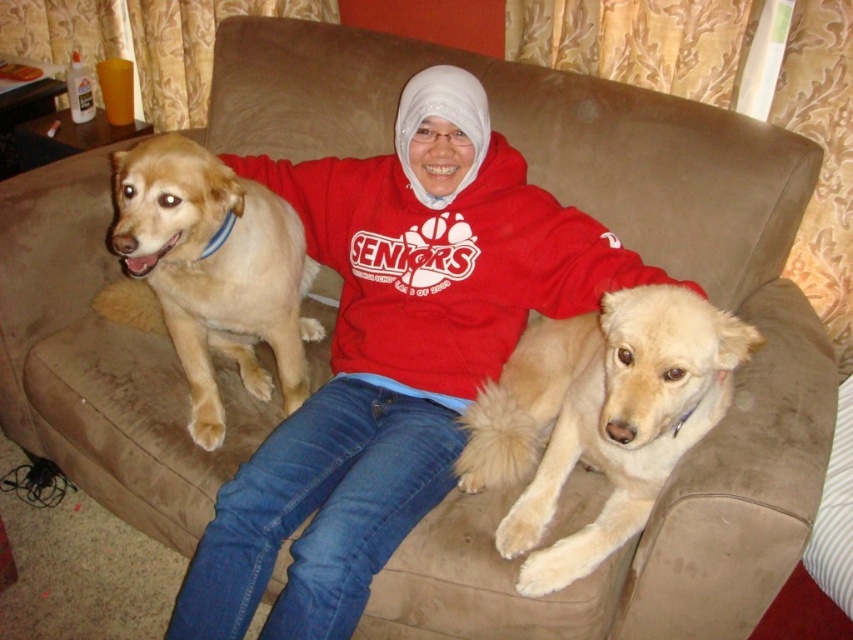
In the scene shown: You are a photographer trying to capture a photo of the fuzzy beige dog at center and the golden fur dog at left. If you want to ensure both dogs are in focus, which dog should you focus on first, the taller one or the shorter one?

The fuzzy beige dog at center is shorter than the golden fur dog at left. To ensure both are in focus, you should focus on the taller golden fur dog at left first, as focusing on the closer subject can help maintain focus on both.

Based on the photo, where is the fuzzy beige dog at center located in the image?

The fuzzy beige dog at center is located at point (599, 419).